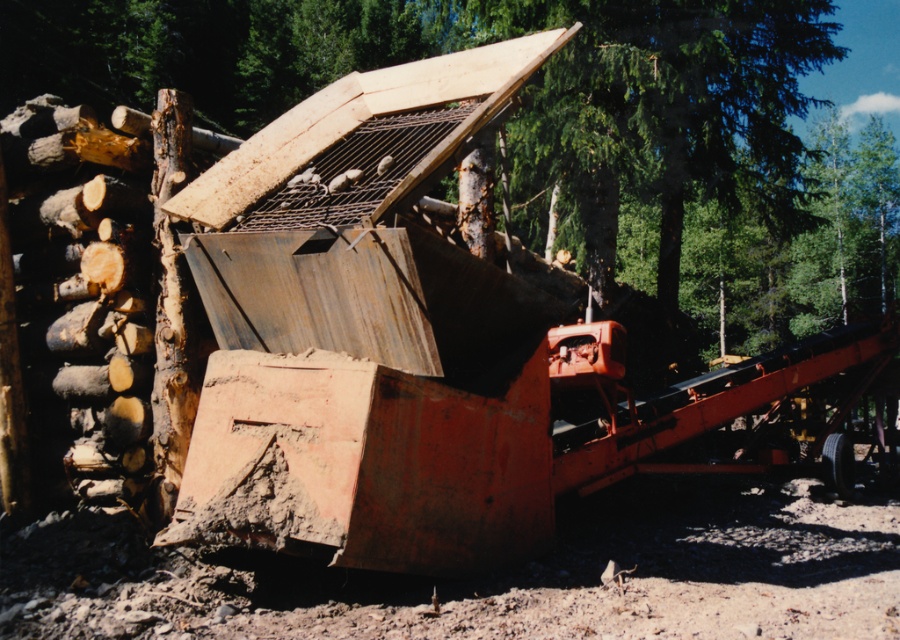
Does rusty metal trailer truck at center have a lesser width compared to smooth wooden log at center?

Correct, rusty metal trailer truck at center's width is less than smooth wooden log at center's.

At what (x,y) coordinates should I click in order to perform the action: click on rusty metal trailer truck at center. Please return your answer as a coordinate pair (x, y). The image size is (900, 640). Looking at the image, I should click on [496, 444].

Does point (338, 392) come in front of point (684, 176)?

Yes, point (338, 392) is in front of point (684, 176).

I want to click on rusty metal trailer truck at center, so click(x=496, y=444).